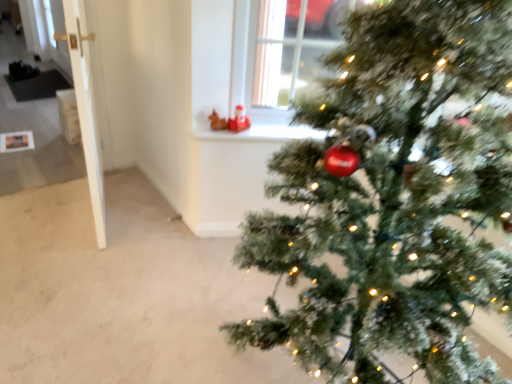
Locate an element on the screen. white glossy window sill at upper center is located at coordinates (259, 133).

What do you see at coordinates (259, 133) in the screenshot? I see `white glossy window sill at upper center` at bounding box center [259, 133].

What do you see at coordinates (394, 196) in the screenshot? The image size is (512, 384). I see `green frosted christmas tree at right` at bounding box center [394, 196].

This screenshot has height=384, width=512. Identify the location of green frosted christmas tree at right. (394, 196).

What is the approximate width of green frosted christmas tree at right?

green frosted christmas tree at right is 1.00 meters wide.

Identify the location of white glossy window sill at upper center. The width and height of the screenshot is (512, 384). (259, 133).

Is white glossy window sill at upper center at the left side of green frosted christmas tree at right?

Indeed, white glossy window sill at upper center is positioned on the left side of green frosted christmas tree at right.

Which object is closer to the camera, white glossy window sill at upper center or green frosted christmas tree at right?

Positioned in front is green frosted christmas tree at right.

Does point (262, 139) appear closer or farther from the camera than point (405, 306)?

Point (262, 139) is farther from the camera than point (405, 306).

From the image's perspective, which one is positioned higher, white glossy window sill at upper center or green frosted christmas tree at right?

white glossy window sill at upper center, from the image's perspective.

From a real-world perspective, which is physically above, white glossy window sill at upper center or green frosted christmas tree at right?

In real-world perspective, green frosted christmas tree at right is above.

Looking at their sizes, would you say white glossy window sill at upper center is wider or thinner than green frosted christmas tree at right?

white glossy window sill at upper center is thinner than green frosted christmas tree at right.

Who is shorter, white glossy window sill at upper center or green frosted christmas tree at right?

Standing shorter between the two is white glossy window sill at upper center.

Is white glossy window sill at upper center smaller than green frosted christmas tree at right?

Indeed, white glossy window sill at upper center has a smaller size compared to green frosted christmas tree at right.

Could green frosted christmas tree at right be considered to be inside white glossy window sill at upper center?

No, green frosted christmas tree at right is not surrounded by white glossy window sill at upper center.

Are white glossy window sill at upper center and green frosted christmas tree at right far apart?

They are positioned close to each other.

Does white glossy window sill at upper center turn towards green frosted christmas tree at right?

Yes, white glossy window sill at upper center is aimed at green frosted christmas tree at right.

Can you tell me how much white glossy window sill at upper center and green frosted christmas tree at right differ in facing direction?

They differ by 62.2 degrees in their facing directions.

How distant is white glossy window sill at upper center from green frosted christmas tree at right?

white glossy window sill at upper center and green frosted christmas tree at right are 32.32 inches apart from each other.

In the image, there is a white glossy window sill at upper center. Where is `christmas tree below it (from the image's perspective)`? christmas tree below it (from the image's perspective) is located at coordinates click(394, 196).

Can you confirm if green frosted christmas tree at right is positioned to the left of white glossy window sill at upper center?

In fact, green frosted christmas tree at right is to the right of white glossy window sill at upper center.

Does green frosted christmas tree at right lie behind white glossy window sill at upper center?

No, green frosted christmas tree at right is closer to the camera.

From the picture: Which is farther from the camera, (451,313) or (270,136)?

The point (270,136) is farther.

From the image's perspective, is green frosted christmas tree at right below white glossy window sill at upper center?

Yes, from the image's perspective, green frosted christmas tree at right is beneath white glossy window sill at upper center.

From a real-world perspective, which is physically below, green frosted christmas tree at right or white glossy window sill at upper center?

white glossy window sill at upper center, from a real-world perspective.

Looking at their sizes, would you say green frosted christmas tree at right is wider or thinner than white glossy window sill at upper center?

In the image, green frosted christmas tree at right appears to be wider than white glossy window sill at upper center.

Considering the sizes of objects green frosted christmas tree at right and white glossy window sill at upper center in the image provided, who is shorter, green frosted christmas tree at right or white glossy window sill at upper center?

Standing shorter between the two is white glossy window sill at upper center.

Which of these two, green frosted christmas tree at right or white glossy window sill at upper center, is bigger?

Bigger between the two is green frosted christmas tree at right.

Is white glossy window sill at upper center completely or partially inside green frosted christmas tree at right?

No.

Can you see green frosted christmas tree at right touching white glossy window sill at upper center?

No, green frosted christmas tree at right is not touching white glossy window sill at upper center.

Is green frosted christmas tree at right aimed at white glossy window sill at upper center?

No, green frosted christmas tree at right is not aimed at white glossy window sill at upper center.

Can you tell me how much green frosted christmas tree at right and white glossy window sill at upper center differ in facing direction?

They differ by 62.2 degrees in their facing directions.

Measure the distance from green frosted christmas tree at right to white glossy window sill at upper center.

green frosted christmas tree at right is 32.32 inches from white glossy window sill at upper center.

Locate an element on the screen. christmas tree that is below the white glossy window sill at upper center (from the image's perspective) is located at coordinates (394, 196).

What are the coordinates of `christmas tree on the right of white glossy window sill at upper center` in the screenshot? It's located at (394, 196).

The width and height of the screenshot is (512, 384). Identify the location of window sill above the green frosted christmas tree at right (from the image's perspective). (259, 133).